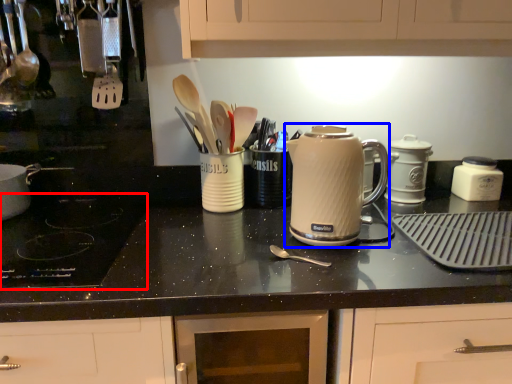
Question: Among these objects, which one is nearest to the camera, gas stove (highlighted by a red box) or kitchen appliance (highlighted by a blue box)?

Choices:
 (A) gas stove
 (B) kitchen appliance

Answer: (A)